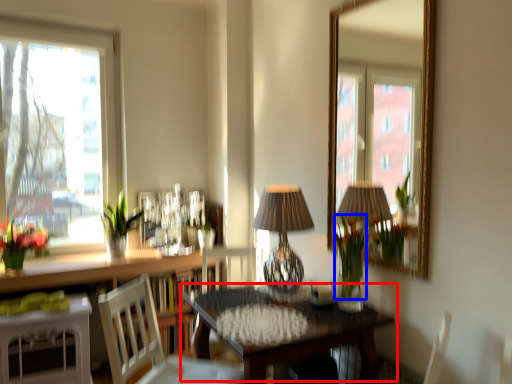
Question: Among these objects, which one is nearest to the camera, table (highlighted by a red box) or flower (highlighted by a blue box)?

Choices:
 (A) table
 (B) flower

Answer: (A)